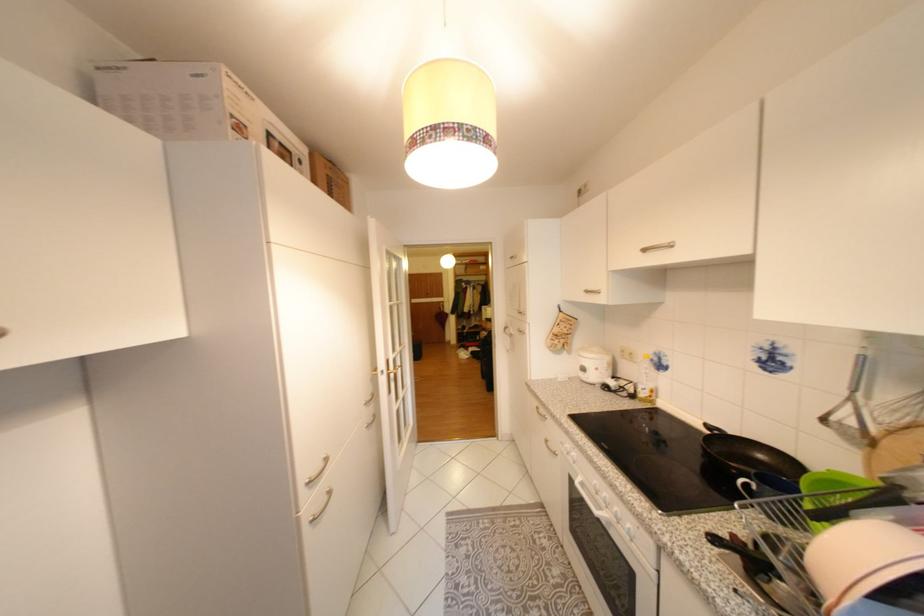
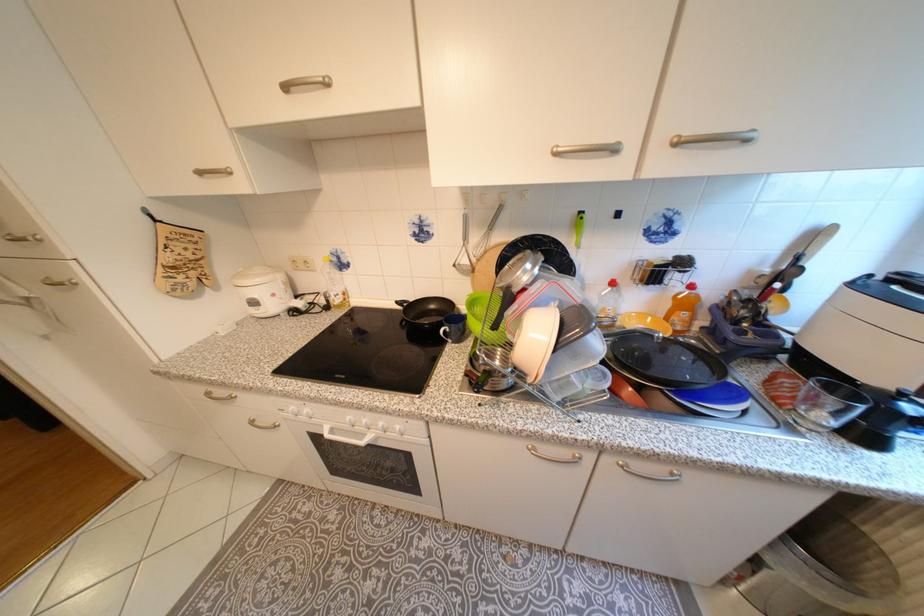
In the second image, find the point that corresponds to [586,484] in the first image.

(335, 436)